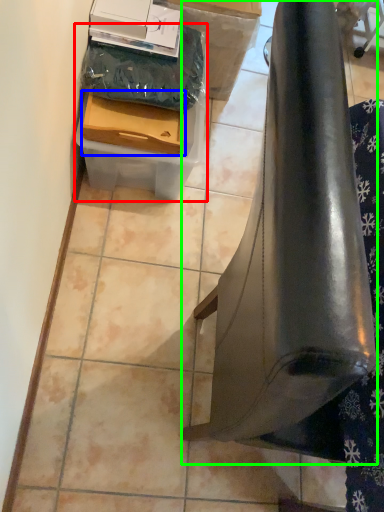
Question: Which object is positioned closest to box (highlighted by a red box)? Select from box (highlighted by a blue box) and furniture (highlighted by a green box).

Choices:
 (A) box
 (B) furniture

Answer: (A)